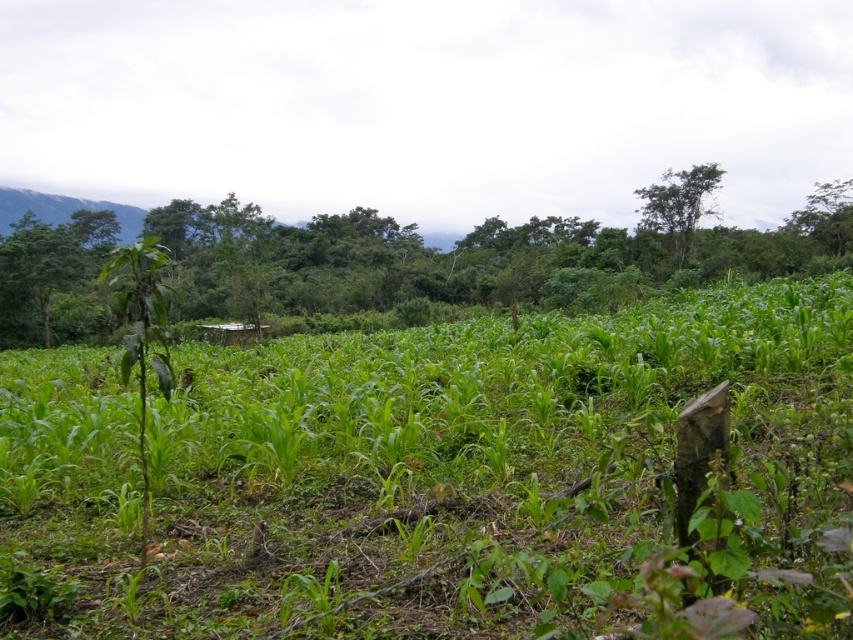
Who is taller, green leafy corn at center or green leafy tree at upper right?

green leafy tree at upper right is taller.

Does green leafy corn at center appear over green leafy tree at upper right?

Actually, green leafy corn at center is below green leafy tree at upper right.

Find the location of a particular element. green leafy corn at center is located at coordinates (431, 476).

The height and width of the screenshot is (640, 853). What are the coordinates of `green leafy corn at center` in the screenshot? It's located at (431, 476).

Can you confirm if green leafy corn at center is positioned to the left of green leafy tree at center?

Incorrect, green leafy corn at center is not on the left side of green leafy tree at center.

Who is more forward, (503, 429) or (402, 250)?

Point (503, 429) is more forward.

Who is more distant from viewer, (384, 525) or (685, 216)?

The point (685, 216) is behind.

Where is `green leafy corn at center`? green leafy corn at center is located at coordinates (431, 476).

Is green leafy tree at center wider than green leafy tree at upper right?

Yes, green leafy tree at center is wider than green leafy tree at upper right.

What do you see at coordinates (480, 253) in the screenshot? I see `green leafy tree at center` at bounding box center [480, 253].

Which is behind, point (311, 246) or point (651, 202)?

The point (311, 246) is more distant.

Identify the location of green leafy tree at center. (480, 253).